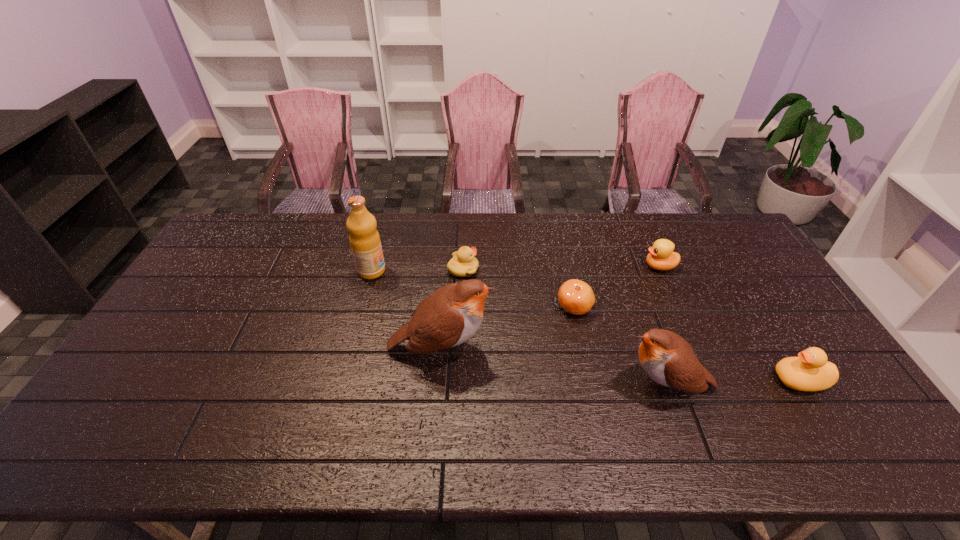
The height and width of the screenshot is (540, 960). In order to click on vacant space situated 0.210m at the face of the shorter bird in this screenshot , I will do `click(538, 386)`.

The image size is (960, 540). I want to click on vacant space located 0.210m at the face of the shorter bird, so click(538, 386).

You are a GUI agent. You are given a task and a screenshot of the screen. Output one action in this format:
    pyautogui.click(x=<x>, y=<y>)
    Task: Click on the free space located at the face of the shorter bird
    This screenshot has height=540, width=960.
    Given the screenshot: What is the action you would take?
    pyautogui.click(x=476, y=386)

Where is `free space located 0.400m on the face of the taller duckling`? free space located 0.400m on the face of the taller duckling is located at coordinates (524, 267).

Identify the location of free space located 0.300m on the face of the taller duckling. (554, 267).

Locate an element on the screen. Image resolution: width=960 pixels, height=540 pixels. vacant area located 0.300m on the face of the taller duckling is located at coordinates (554, 267).

Find the location of a particular element. The width and height of the screenshot is (960, 540). vacant space situated 0.170m on the front label of the fruit juice is located at coordinates (437, 271).

Where is `vacant area situated on the front of the clementine`? This screenshot has width=960, height=540. vacant area situated on the front of the clementine is located at coordinates (581, 335).

Find the location of a particular element. blank area located 0.300m on the beak of the left duckling is located at coordinates (568, 269).

I want to click on vacant space located on the face of the duck, so click(645, 380).